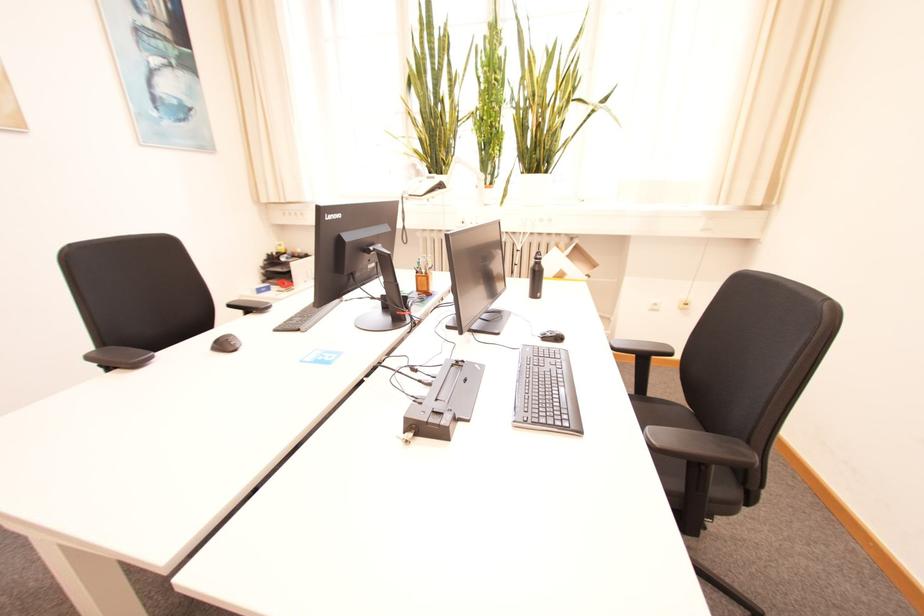
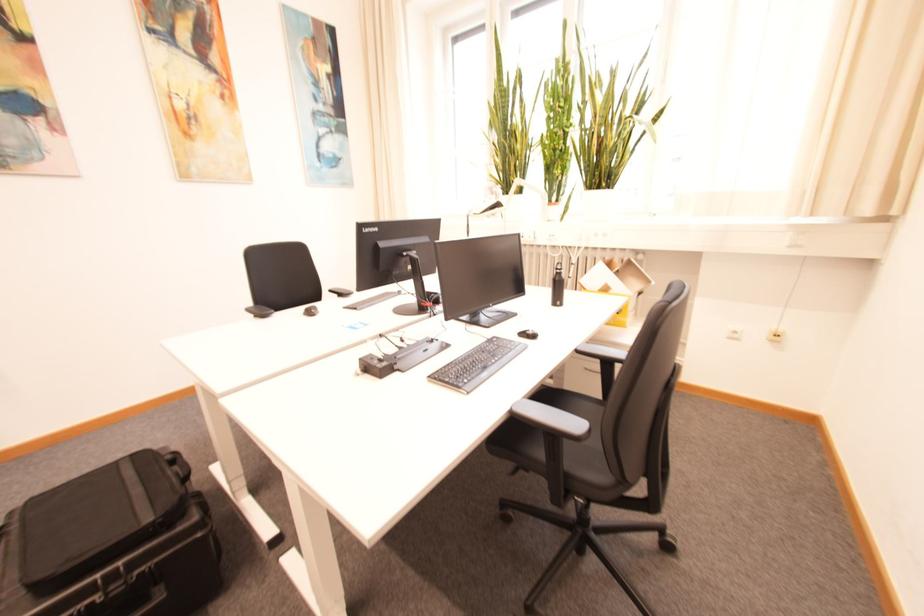
Question: The images are taken continuously from a first-person perspective. In which direction is your viewpoint rotating?

Choices:
 (A) Left
 (B) Right
 (C) Up
 (D) Down

Answer: (A)